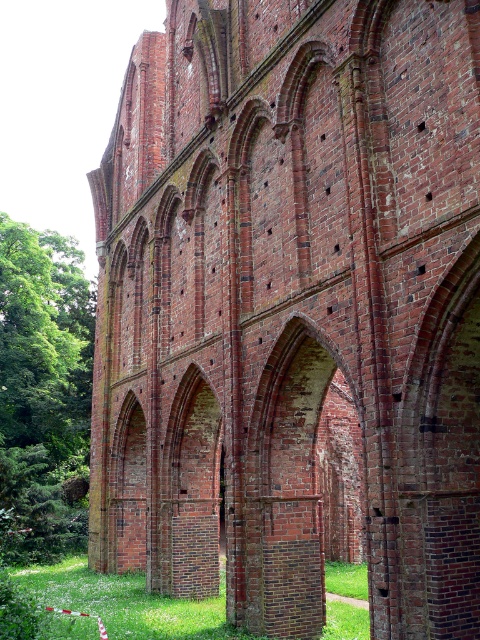
Question: Which object appears closest to the camera in this image?

Choices:
 (A) green leafy tree at left
 (B) green grass at lower center

Answer: (B)

Question: Can you confirm if green leafy tree at left is positioned above green grass at lower center?

Choices:
 (A) no
 (B) yes

Answer: (B)

Question: Which of the following is the farthest from the observer?

Choices:
 (A) green leafy tree at left
 (B) green grass at lower center

Answer: (A)

Question: Can you confirm if green leafy tree at left is smaller than green grass at lower center?

Choices:
 (A) no
 (B) yes

Answer: (A)

Question: Observing the image, what is the correct spatial positioning of green leafy tree at left in reference to green grass at lower center?

Choices:
 (A) below
 (B) above

Answer: (B)

Question: Which of the following is the closest to the observer?

Choices:
 (A) green leafy tree at left
 (B) green grass at lower center

Answer: (B)